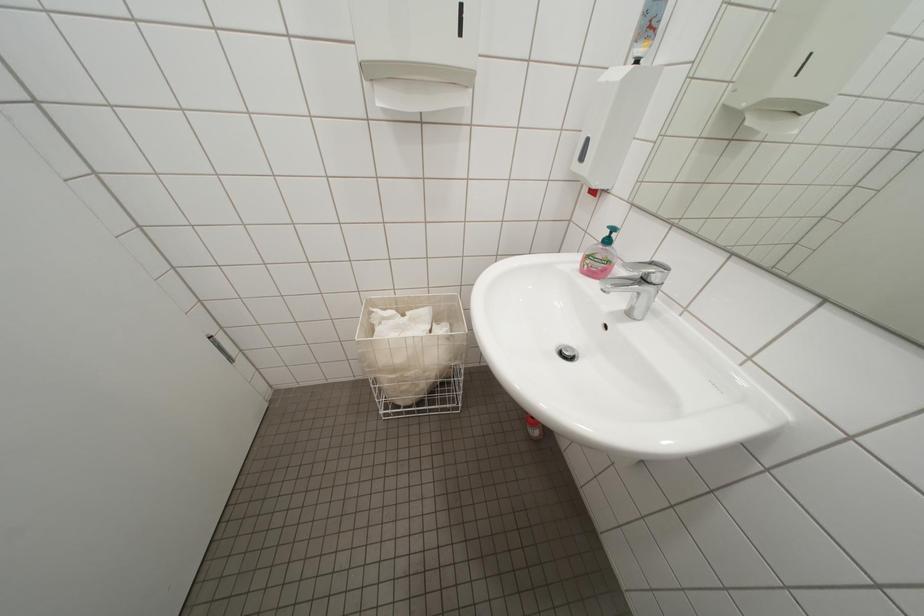
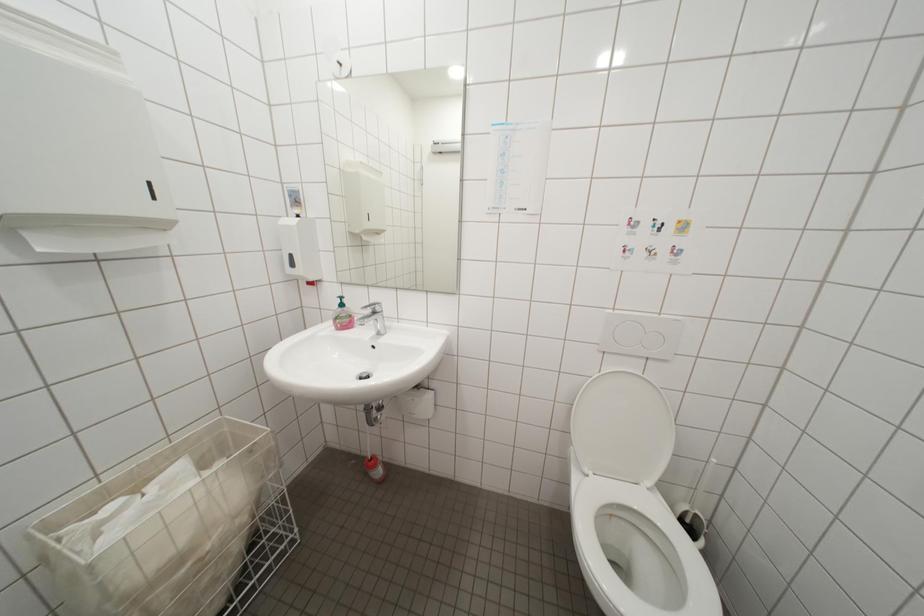
Question: The camera is either moving clockwise (left) or counter-clockwise (right) around the object. The first image is from the beginning of the video and the second image is from the end. Is the camera moving left or right when shooting the video?

Choices:
 (A) Left
 (B) Right

Answer: (A)